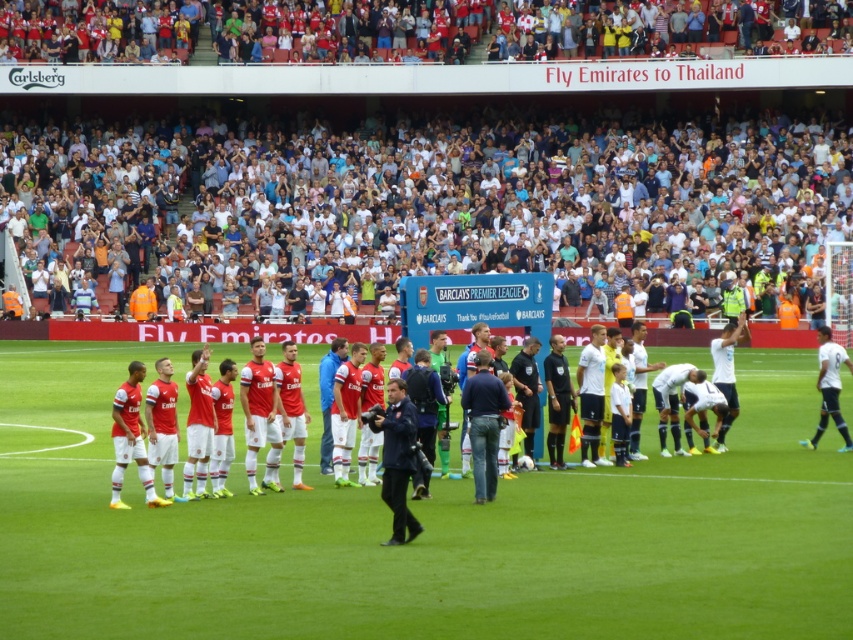
Which is below, white cotton crowd at upper center or red matte soccer team at center?

red matte soccer team at center

Is point (368, 241) behind point (310, 332)?

That is True.

Find the location of a particular element. white cotton crowd at upper center is located at coordinates (427, 212).

Is point (178, 336) closer to camera compared to point (840, 356)?

That is False.

Is red matte soccer team at center taller than white smooth soccer player at right?

Yes.

The height and width of the screenshot is (640, 853). In order to click on red matte soccer team at center in this screenshot , I will do tap(236, 332).

Which is behind, point (527, 528) or point (827, 378)?

Point (827, 378)

Is white synthetic turf at center taller than white smooth soccer player at right?

No.

Image resolution: width=853 pixels, height=640 pixels. In order to click on white synthetic turf at center in this screenshot , I will do `click(422, 532)`.